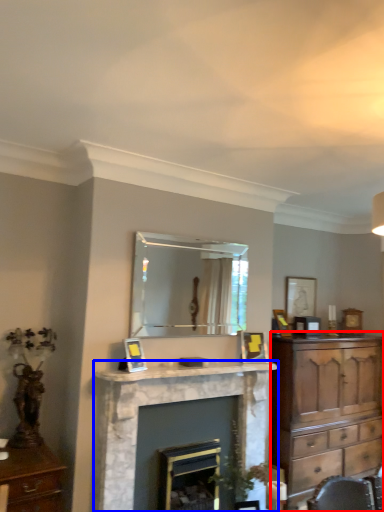
Question: Which point is closer to the camera, chest of drawers (highlighted by a red box) or fireplace (highlighted by a blue box)?

Choices:
 (A) chest of drawers
 (B) fireplace

Answer: (B)